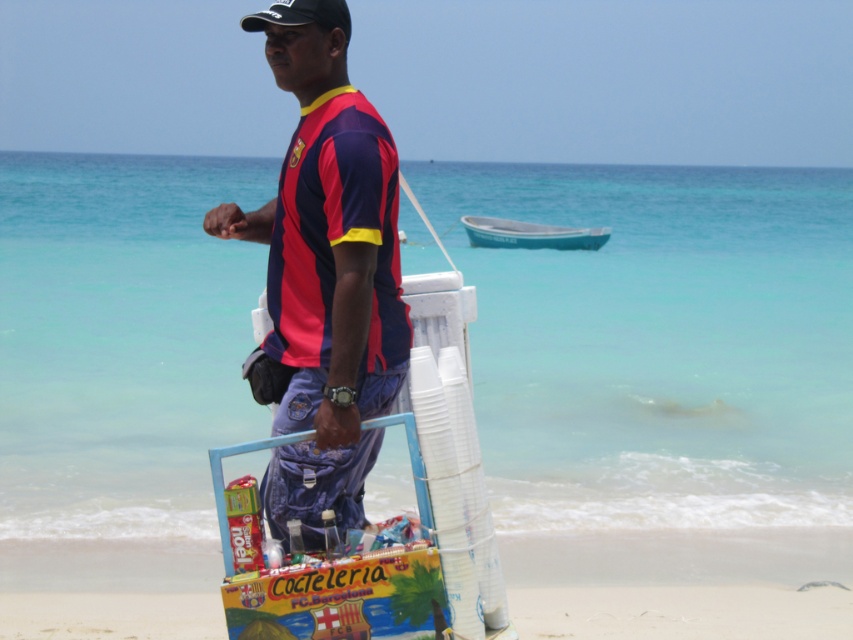
Question: Can you confirm if matte red and blue jersey at center is positioned to the right of white plastic cups at center?

Choices:
 (A) no
 (B) yes

Answer: (A)

Question: Does matte red and blue jersey at center appear on the right side of teal plastic boat at center?

Choices:
 (A) no
 (B) yes

Answer: (A)

Question: Does matte red and blue jersey at center appear over white plastic cups at center?

Choices:
 (A) yes
 (B) no

Answer: (A)

Question: Which object appears farthest from the camera in this image?

Choices:
 (A) white plastic cups at center
 (B) teal plastic boat at center
 (C) matte red and blue jersey at center

Answer: (B)

Question: Which point is farther from the camera taking this photo?

Choices:
 (A) 305,324
 (B) 679,573
 (C) 527,244

Answer: (C)

Question: Which of the following is the farthest from the observer?

Choices:
 (A) (757, 625)
 (B) (384, 381)
 (C) (544, 241)

Answer: (C)